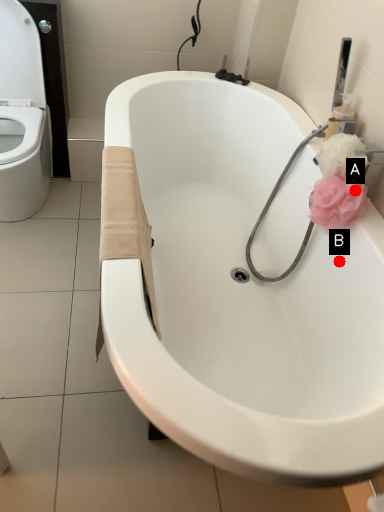
Question: Two points are circled on the image, labeled by A and B beside each circle. Which point appears closest to the camera in this image?

Choices:
 (A) A is closer
 (B) B is closer

Answer: (A)